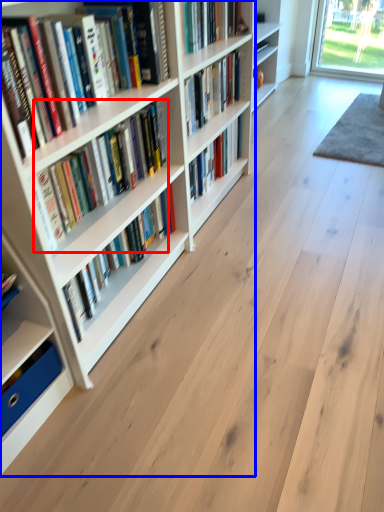
Question: Which of the following is the farthest to the observer, book (highlighted by a red box) or bookcase (highlighted by a blue box)?

Choices:
 (A) book
 (B) bookcase

Answer: (A)